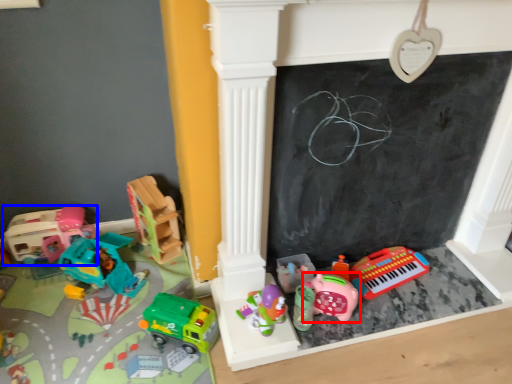
Question: Which of the following is the closest to the observer, toy (highlighted by a red box) or toy (highlighted by a blue box)?

Choices:
 (A) toy
 (B) toy

Answer: (A)